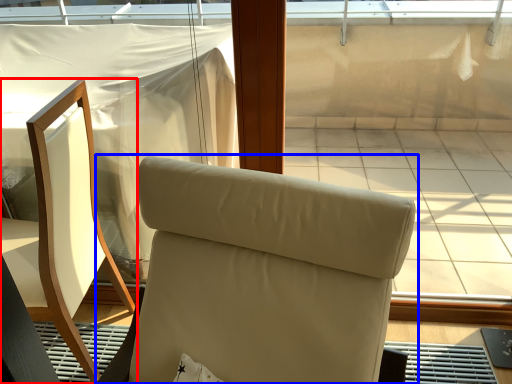
Question: Which of the following is the farthest to the observer, chair (highlighted by a red box) or chair (highlighted by a blue box)?

Choices:
 (A) chair
 (B) chair

Answer: (A)